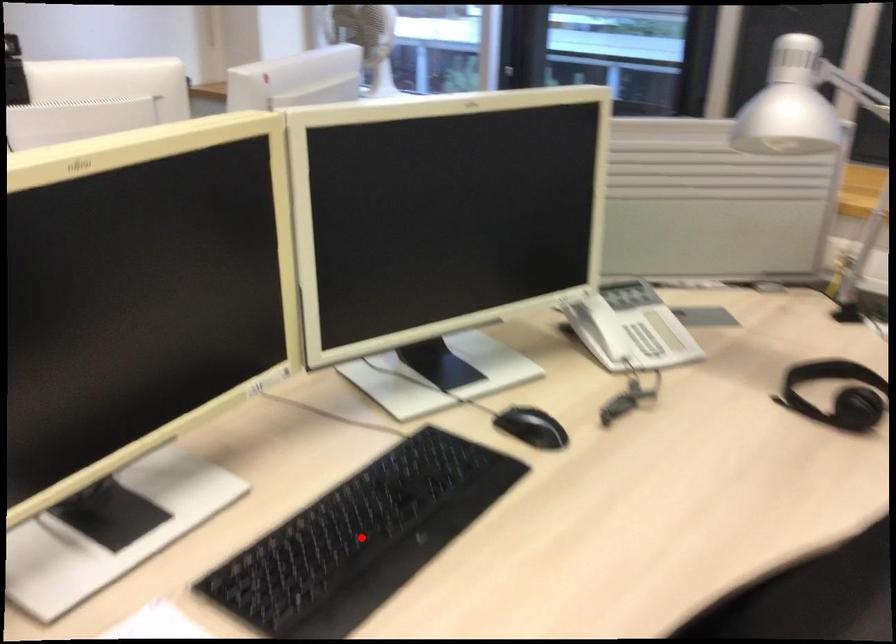
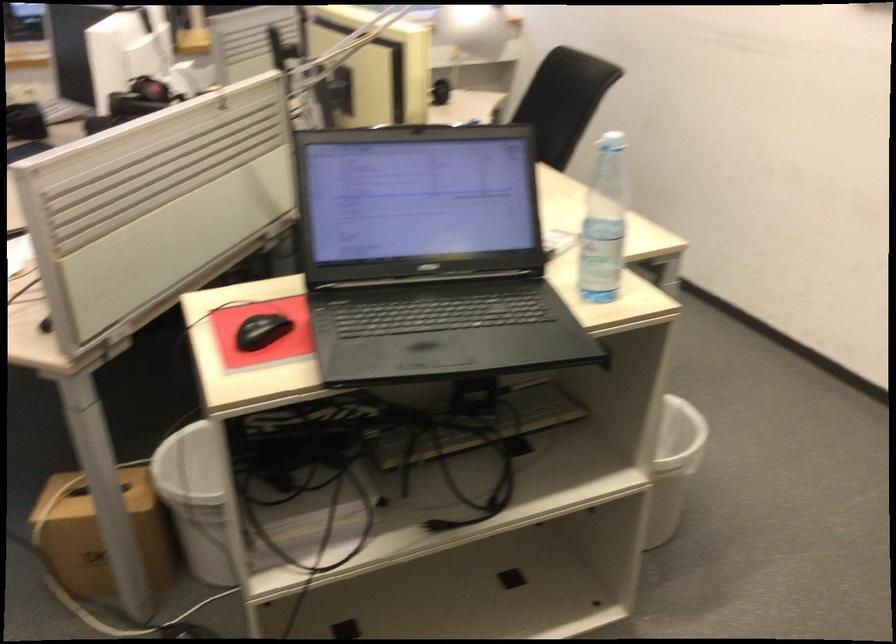
Question: I am providing you with two images of the same scene from different viewpoints. A red point is marked on the first image. Is the red point's position out of view in image 2?

Choices:
 (A) Yes
 (B) No

Answer: (A)